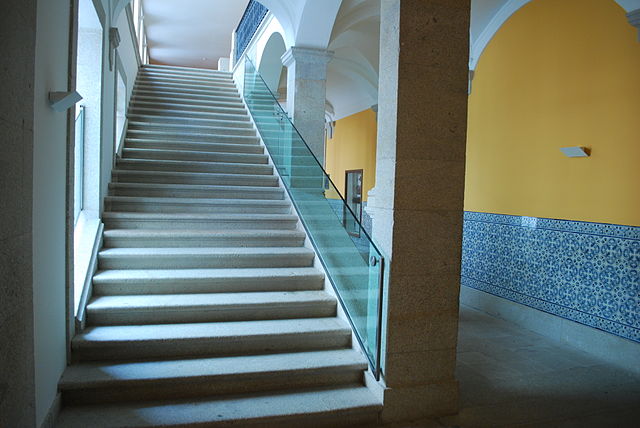
Image resolution: width=640 pixels, height=428 pixels. What are the coordinates of `floor` in the screenshot? It's located at (548, 382).